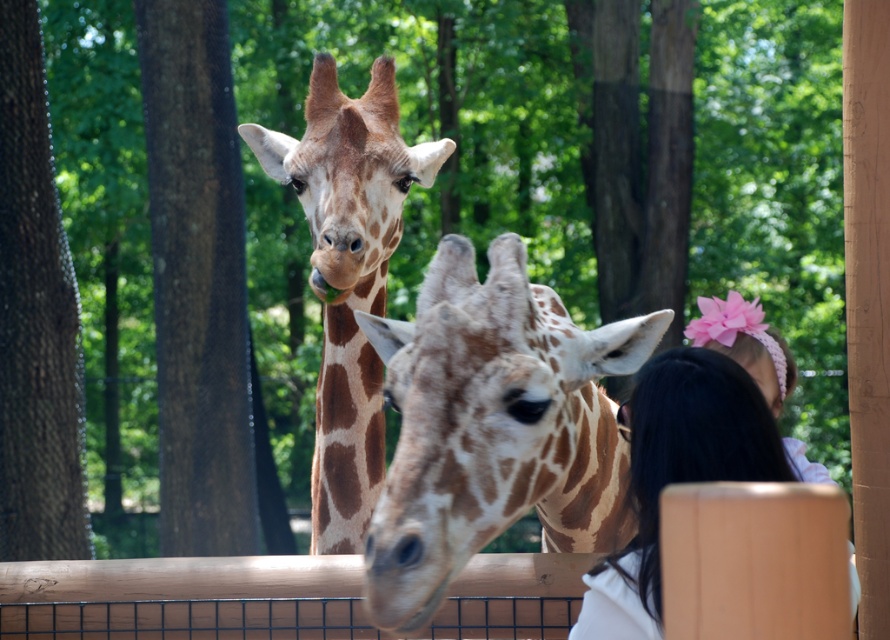
Which is more to the left, spotted fur giraffe at center or smooth white shirt at lower right?

spotted fur giraffe at center is more to the left.

Does point (474, 509) come closer to viewer compared to point (723, 406)?

No.

This screenshot has height=640, width=890. Find the location of `spotted fur giraffe at center`. spotted fur giraffe at center is located at coordinates (494, 426).

How far apart are spotted fur giraffe at center and brown spotted giraffe at center?

A distance of 16.98 inches exists between spotted fur giraffe at center and brown spotted giraffe at center.

Does spotted fur giraffe at center come in front of brown spotted giraffe at center?

Yes.

Between point (565, 374) and point (310, 259), which one is positioned in front?

Point (565, 374)

You are a GUI agent. You are given a task and a screenshot of the screen. Output one action in this format:
    pyautogui.click(x=<x>, y=<y>)
    Task: Click on the spotted fur giraffe at center
    
    Given the screenshot: What is the action you would take?
    click(494, 426)

Can you confirm if brown spotted giraffe at center is positioned to the right of smooth white shirt at lower right?

No, brown spotted giraffe at center is not to the right of smooth white shirt at lower right.

Consider the image. Can you confirm if brown spotted giraffe at center is positioned above smooth white shirt at lower right?

Yes, brown spotted giraffe at center is above smooth white shirt at lower right.

The height and width of the screenshot is (640, 890). I want to click on brown spotted giraffe at center, so click(348, 273).